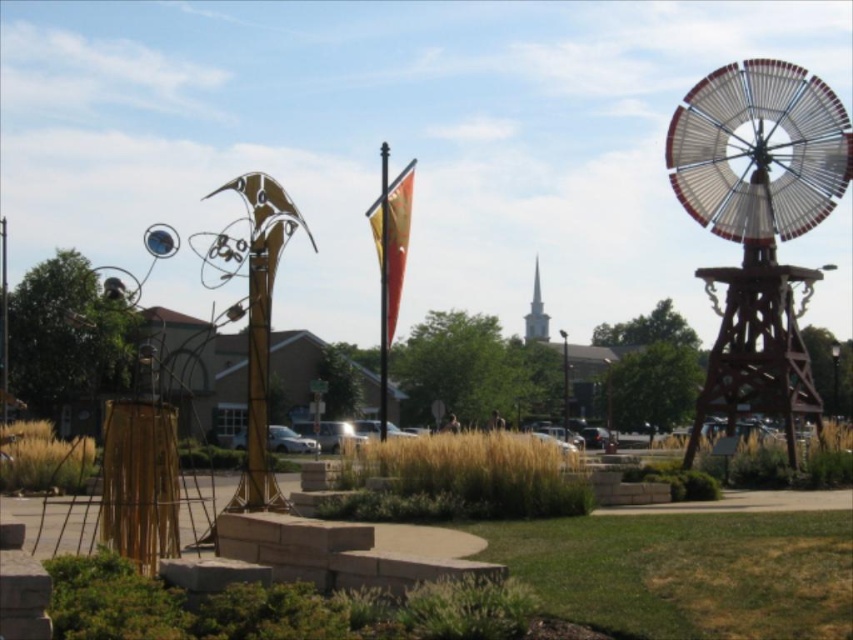
Does orange fabric flag at center have a larger size compared to metallic flagpole at center?

Actually, orange fabric flag at center might be smaller than metallic flagpole at center.

Between point (393, 252) and point (380, 189), which one is positioned in front?

Point (393, 252)

The width and height of the screenshot is (853, 640). In order to click on orange fabric flag at center in this screenshot , I will do `click(392, 241)`.

Who is higher up, orange fabric flag at center or white steeple at center?

orange fabric flag at center is higher up.

Between point (397, 220) and point (538, 285), which one is positioned behind?

Positioned behind is point (538, 285).

What are the coordinates of `orange fabric flag at center` in the screenshot? It's located at (392, 241).

Measure the distance between point [753,387] and camera.

393.17 feet

You are a GUI agent. You are given a task and a screenshot of the screen. Output one action in this format:
    pyautogui.click(x=<x>, y=<y>)
    Task: Click on the wooden windmill at right
    Image resolution: width=853 pixels, height=640 pixels.
    Given the screenshot: What is the action you would take?
    pyautogui.click(x=758, y=227)

The height and width of the screenshot is (640, 853). What are the coordinates of `wooden windmill at right` in the screenshot? It's located at (758, 227).